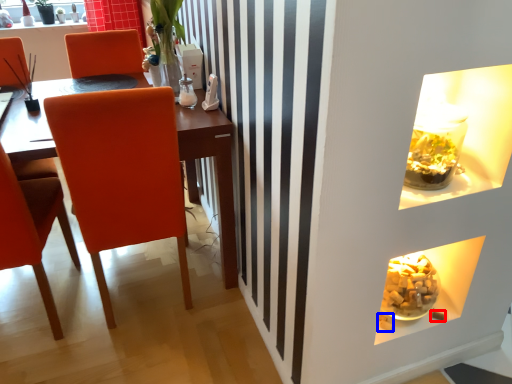
Question: Which of the following is the farthest to the observer, food (highlighted by a red box) or food (highlighted by a blue box)?

Choices:
 (A) food
 (B) food

Answer: (A)